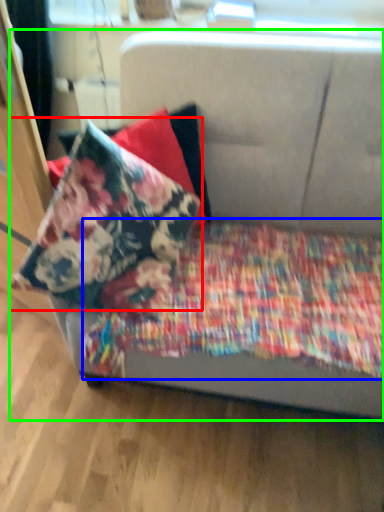
Question: Which is nearer to the pillow (highlighted by a red box)? blanket (highlighted by a blue box) or studio couch (highlighted by a green box).

Choices:
 (A) blanket
 (B) studio couch

Answer: (A)